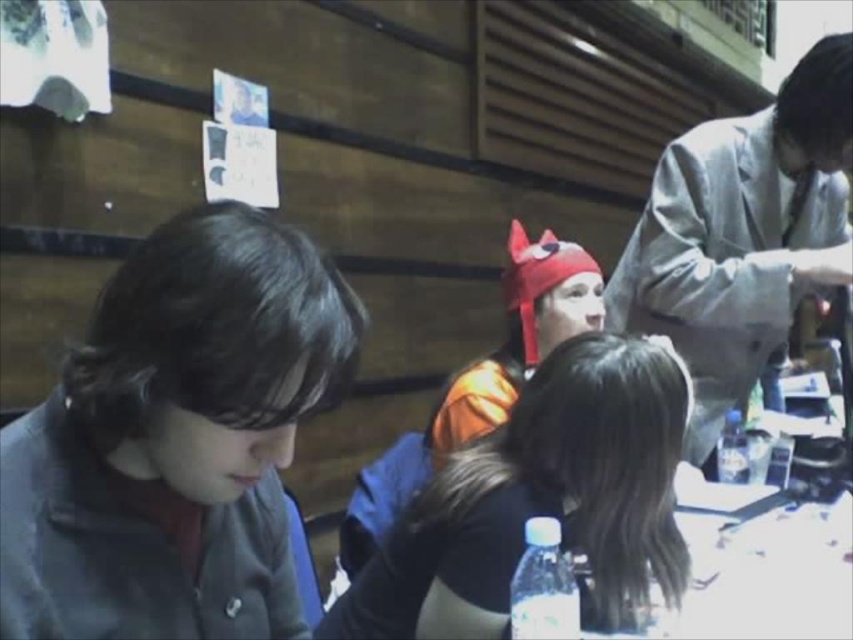
You are a photographer setting up a shot in the scene. You need to position a spotlight so it illuminates both the dark gray fabric at left and the gray fabric suit at upper right without overlapping their light areas. Based on their positions, which object should you place the spotlight closer to?

The dark gray fabric at left is located below the gray fabric suit at upper right. To illuminate both without overlapping light areas, position the spotlight closer to the gray fabric suit at upper right since it is higher up, allowing the light to reach both the upper and lower positions effectively.

In the image, there is a point labeled at coordinates (544,493). Based on the scene description, what object is located at that point?

The point at coordinates (544,493) corresponds to the orange fabric mask at center.